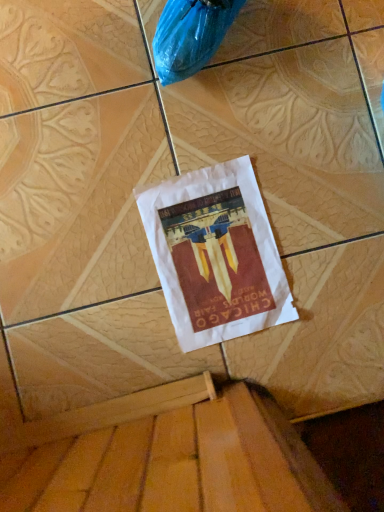
Describe the element at coordinates (215, 254) in the screenshot. I see `white paper at center` at that location.

Measure the distance between point (252, 285) and camera.

28.86 inches.

Identify the location of white paper at center. (215, 254).

In order to click on white paper at center in this screenshot , I will do `click(215, 254)`.